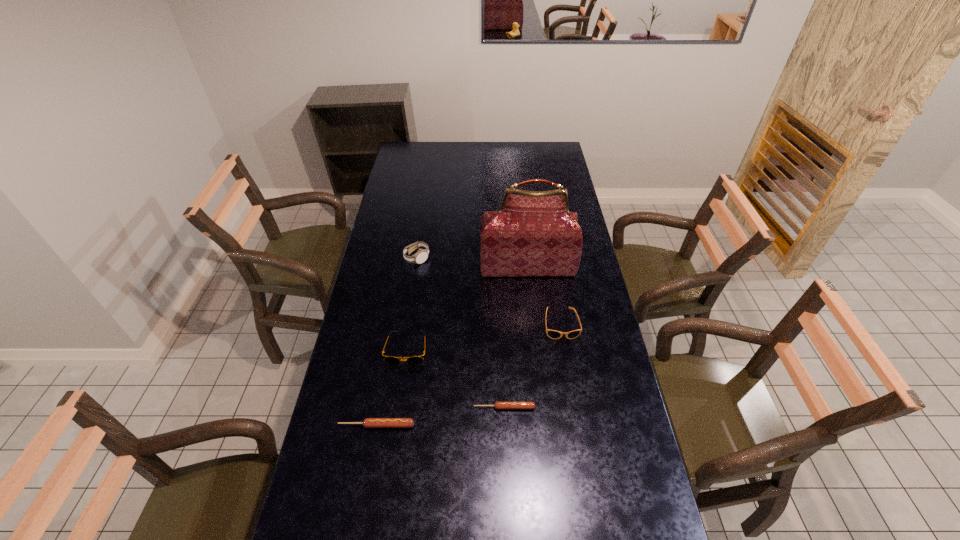
Locate an element on the screen. Image resolution: width=960 pixels, height=540 pixels. vacant space located 0.180m on the front-facing side of the left sunglasses is located at coordinates (397, 417).

The height and width of the screenshot is (540, 960). I want to click on free region located 0.130m on the front-facing side of the right sunglasses, so click(x=568, y=372).

You are a GUI agent. You are given a task and a screenshot of the screen. Output one action in this format:
    pyautogui.click(x=<x>, y=<y>)
    Task: Click on the vacant space positioned 0.140m on the front-facing side of the tallest object
    
    Given the screenshot: What is the action you would take?
    pyautogui.click(x=532, y=304)

Locate an element on the screen. This screenshot has width=960, height=540. vacant region located on the face of the watch is located at coordinates (490, 258).

This screenshot has width=960, height=540. In order to click on sausage present at the left edge in this screenshot , I will do `click(368, 422)`.

Image resolution: width=960 pixels, height=540 pixels. What are the coordinates of `sunglasses that is at the left edge` in the screenshot? It's located at (414, 360).

You are a GUI agent. You are given a task and a screenshot of the screen. Output one action in this format:
    pyautogui.click(x=<x>, y=<y>)
    Task: Click on the watch that is at the left edge
    
    Given the screenshot: What is the action you would take?
    pyautogui.click(x=421, y=255)

Identify the location of sunglasses at the right edge. (553, 334).

Find the location of a particular element. This screenshot has width=960, height=540. handbag that is at the right edge is located at coordinates (533, 234).

This screenshot has height=540, width=960. In order to click on vacant space at the far edge of the desktop in this screenshot , I will do `click(493, 158)`.